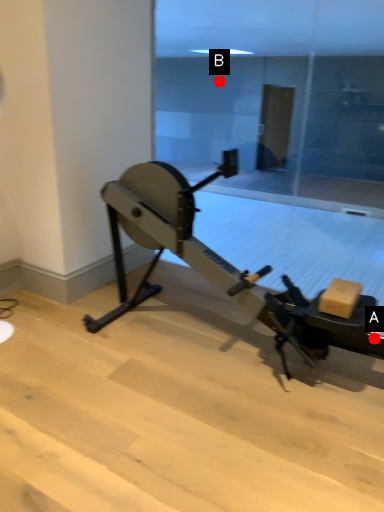
Question: Two points are circled on the image, labeled by A and B beside each circle. Which point appears closest to the camera in this image?

Choices:
 (A) A is closer
 (B) B is closer

Answer: (A)